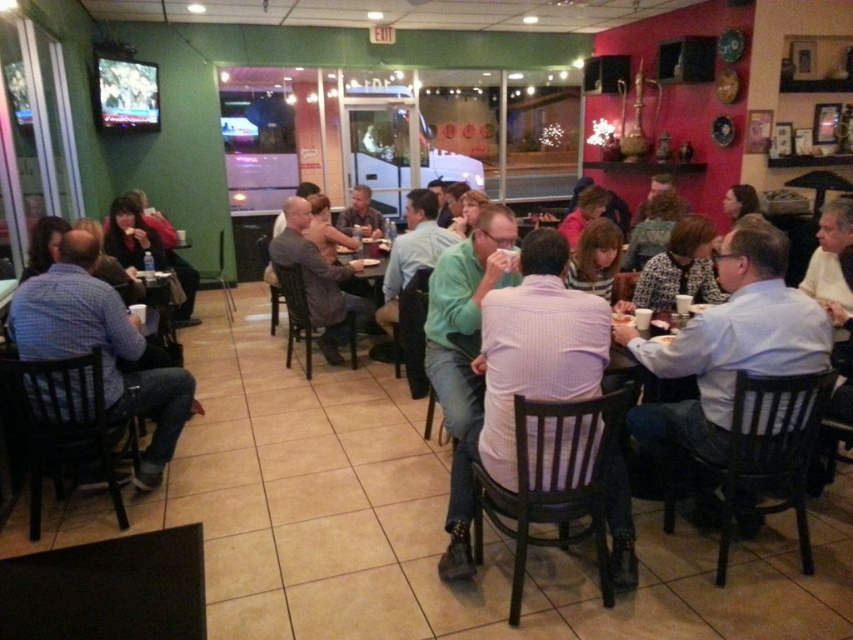
You are a restaurant employee who needs to determine if the white shirt at center and the gray fabric jacket at center can be hung on a single hanger without overlapping. The hanger can hold up to 30 cm in width. What should you do?

The white shirt at center has a width less than the gray fabric jacket at center. To determine if they can fit on the hanger, add both widths. However, since the exact measurements aren

You are standing in the middle of the restaurant and want to walk to the mounted television screen on the green wall. There are two points marked in the image, point 1 at coordinates point (x=651, y=461) and point 2 at coordinates point (x=315, y=321). Which point is closer to you as you face the television screen?

Point (x=651, y=461) is closer to the viewer than point (x=315, y=321). Therefore, point (x=651, y=461) is closer to you as you face the television screen.

You are a waiter in the restaurant and you see two customers wearing a white shirt at center and a blue plaid shirt at left. Which customer is closer to the green wall with the TV?

The blue plaid shirt at left is closer to the green wall with the TV because the white shirt at center is to the right of it, meaning the blue plaid shirt is positioned nearer to the left side where the green wall is located.